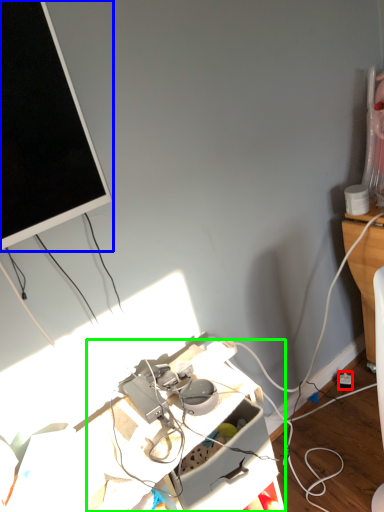
Question: Which is nearer to the power outlet (highlighted by a red box)? television (highlighted by a blue box) or computer desk (highlighted by a green box).

Choices:
 (A) television
 (B) computer desk

Answer: (B)